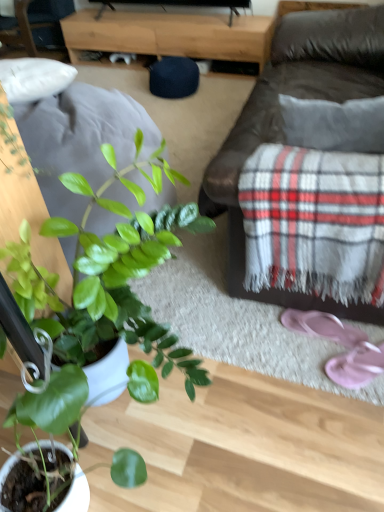
Question: Is green matte plant at lower left not near pink fabric flip-flops at lower right, the 2th footwear from the back?

Choices:
 (A) yes
 (B) no

Answer: (B)

Question: Is green matte plant at lower left looking in the opposite direction of pink fabric flip-flops at lower right, marked as the 1th footwear in a front-to-back arrangement?

Choices:
 (A) no
 (B) yes

Answer: (A)

Question: Is green matte plant at lower left located outside pink fabric flip-flops at lower right, the 2th footwear from the back?

Choices:
 (A) no
 (B) yes

Answer: (B)

Question: Is green matte plant at lower left thinner than pink fabric flip-flops at lower right, the 2th footwear from the back?

Choices:
 (A) yes
 (B) no

Answer: (B)

Question: Does green matte plant at lower left come behind pink fabric flip-flops at lower right, the 2th footwear from the back?

Choices:
 (A) no
 (B) yes

Answer: (A)

Question: Is green matte plant at lower left aimed at pink fabric flip-flops at lower right, the 2th footwear from the back?

Choices:
 (A) no
 (B) yes

Answer: (A)

Question: Can you confirm if wooden tv stand at center is wider than pink fabric flip-flops at lower right, marked as the 1th footwear in a front-to-back arrangement?

Choices:
 (A) no
 (B) yes

Answer: (B)

Question: Does wooden tv stand at center lie behind pink fabric flip-flops at lower right, the 2th footwear from the back?

Choices:
 (A) yes
 (B) no

Answer: (A)

Question: Is wooden tv stand at center facing away from pink fabric flip-flops at lower right, marked as the 1th footwear in a front-to-back arrangement?

Choices:
 (A) no
 (B) yes

Answer: (A)

Question: Is wooden tv stand at center shorter than pink fabric flip-flops at lower right, marked as the 1th footwear in a front-to-back arrangement?

Choices:
 (A) no
 (B) yes

Answer: (A)

Question: Is the surface of wooden tv stand at center in direct contact with pink fabric flip-flops at lower right, marked as the 1th footwear in a front-to-back arrangement?

Choices:
 (A) no
 (B) yes

Answer: (A)

Question: From a real-world perspective, is wooden tv stand at center located higher than pink fabric flip-flops at lower right, the 2th footwear from the back?

Choices:
 (A) yes
 (B) no

Answer: (A)

Question: Is pink fabric flip-flops at lower right, marked as the 1th footwear in a front-to-back arrangement, completely or partially outside of brown leather couch at center?

Choices:
 (A) yes
 (B) no

Answer: (A)